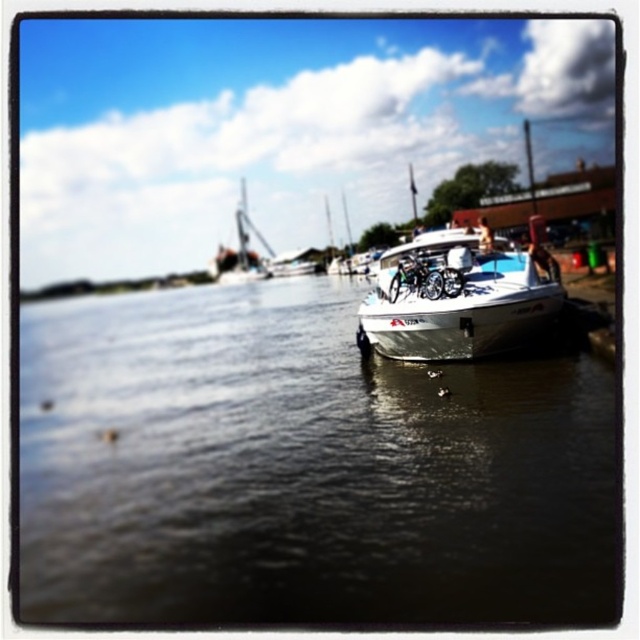
Question: Which point is farther from the camera taking this photo?

Choices:
 (A) (508, 300)
 (B) (157, 576)

Answer: (A)

Question: Can you confirm if white glossy boat at right is positioned above white glossy boat at center?

Choices:
 (A) yes
 (B) no

Answer: (B)

Question: Which object appears farthest from the camera in this image?

Choices:
 (A) white glossy boat at right
 (B) white glossy boat at center

Answer: (B)

Question: Which object is farther from the camera taking this photo?

Choices:
 (A) white glossy boat at center
 (B) white glossy boat at right

Answer: (A)

Question: Considering the relative positions of white glossy boat at right and white glossy boat at center in the image provided, where is white glossy boat at right located with respect to white glossy boat at center?

Choices:
 (A) left
 (B) right

Answer: (A)

Question: Does white glossy boat at right have a greater width compared to white glossy boat at center?

Choices:
 (A) no
 (B) yes

Answer: (B)